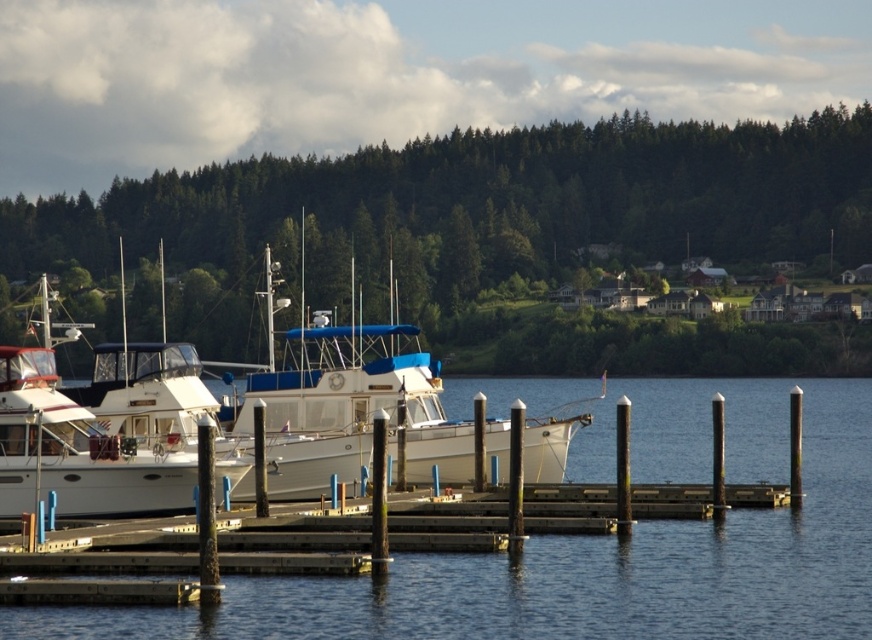
Question: Which of the following is the farthest from the observer?

Choices:
 (A) (774, 209)
 (B) (672, 451)

Answer: (A)

Question: Does green leafy trees at upper center appear on the right side of white glossy boat at left?

Choices:
 (A) no
 (B) yes

Answer: (A)

Question: Is green leafy trees at upper center closer to the viewer compared to white glossy boat at left?

Choices:
 (A) yes
 (B) no

Answer: (B)

Question: Which point is closer to the camera?

Choices:
 (A) (318, 404)
 (B) (760, 512)
 (C) (94, 456)
 (D) (436, 212)

Answer: (C)

Question: Which object appears farthest from the camera in this image?

Choices:
 (A) white glossy boat at center
 (B) white glossy boat at left
 (C) green leafy trees at upper center

Answer: (C)

Question: Considering the relative positions of green leafy trees at upper center and white glossy boat at center in the image provided, where is green leafy trees at upper center located with respect to white glossy boat at center?

Choices:
 (A) right
 (B) left

Answer: (B)